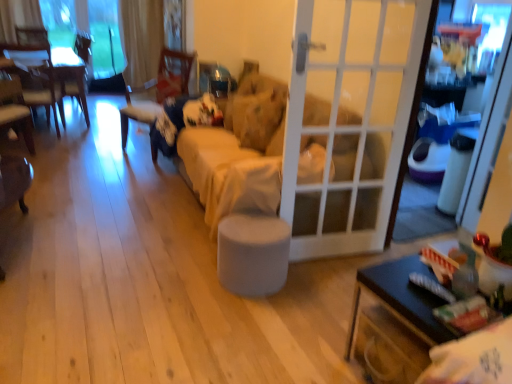
Where is `free space to the left of gray fabric stool at center`? This screenshot has width=512, height=384. free space to the left of gray fabric stool at center is located at coordinates (183, 269).